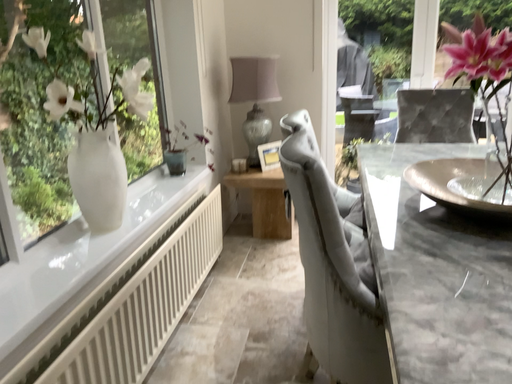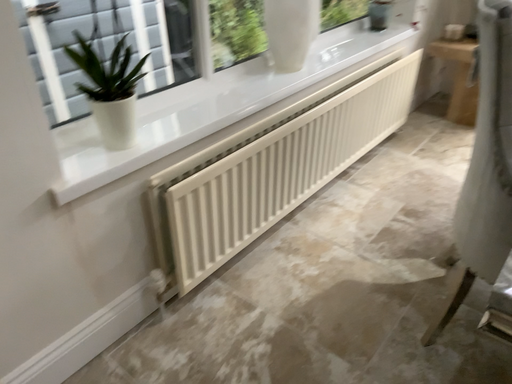
Question: How did the camera likely rotate when shooting the video?

Choices:
 (A) rotated downward
 (B) rotated upward

Answer: (A)